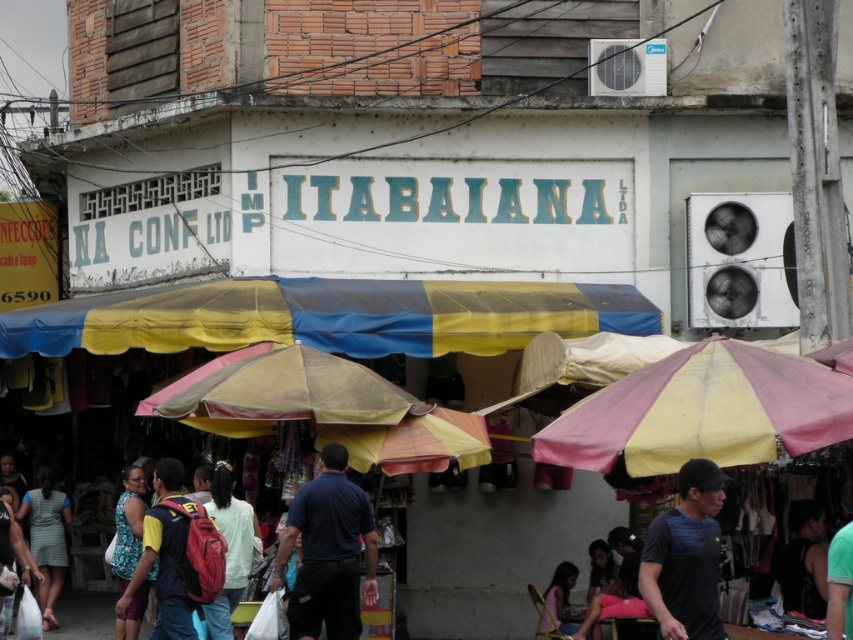
Question: Considering the real-world distances, which object is closest to the dark blue shirt at center?

Choices:
 (A) light blue shirt at lower left
 (B) light blue striped dress at lower left

Answer: (A)

Question: Does beige fabric umbrella at center have a smaller size compared to red backpack at center?

Choices:
 (A) no
 (B) yes

Answer: (A)

Question: Can you confirm if light blue striped dress at lower left is wider than light blue shirt at lower left?

Choices:
 (A) no
 (B) yes

Answer: (B)

Question: Considering the real-world distances, which object is closest to the black matte shirt at center?

Choices:
 (A) light blue shirt at lower left
 (B) blue-green printed blouse at lower left
 (C) blue/yellow fabric canopy at center

Answer: (B)

Question: Based on their relative distances, which object is nearer to the light blue striped dress at lower left?

Choices:
 (A) white matte backpack at center
 (B) dark blue shirt at center

Answer: (A)

Question: Can you confirm if beige fabric umbrella at center is wider than black matte shirt at center?

Choices:
 (A) yes
 (B) no

Answer: (A)